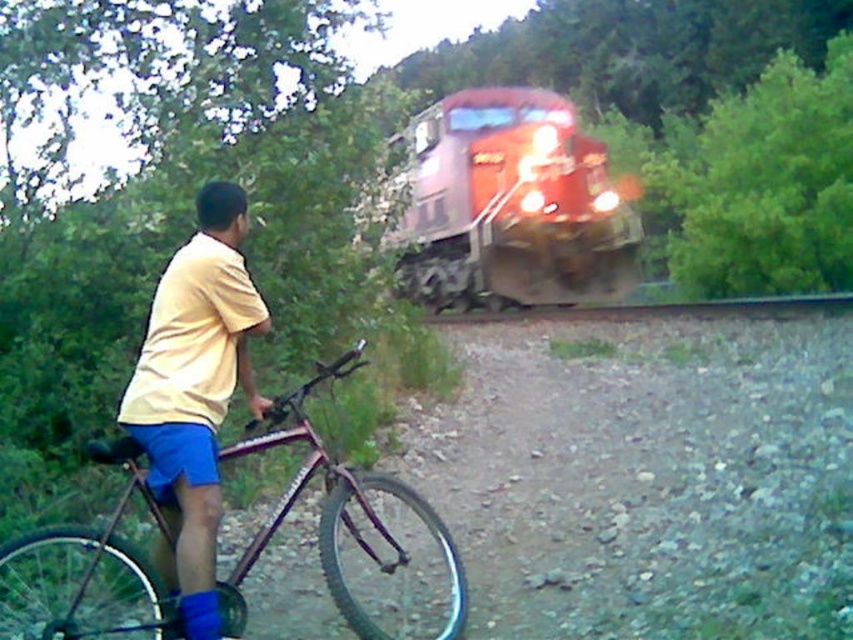
You are a cyclist trying to cross the railway track. You see two points on the track ahead of you at coordinates point (x=437, y=172) and point (x=392, y=493). Which point is closer to you?

Point (x=437, y=172) is further to the viewer than point (x=392, y=493), so the closer point to you is point (x=392, y=493).

You are the cyclist in the scene. You need to quickly move your metallic purple mountain bike at left away from the railway track before the approaching train arrives. Can you move the bike forward past the yellow matte shirt at left to get it to safety?

The metallic purple mountain bike at left is behind the yellow matte shirt at left, so you can move the bike forward past the yellow matte shirt at left to get it to safety.

You are a cyclist who wants to cross the railway track safely. You see a red glossy train at center and a yellow matte shirt at left. Which object is taller and requires your attention first?

The red glossy train at center is taller than the yellow matte shirt at left, so you should pay attention to the red glossy train at center first as it poses a greater height hazard when crossing the track.